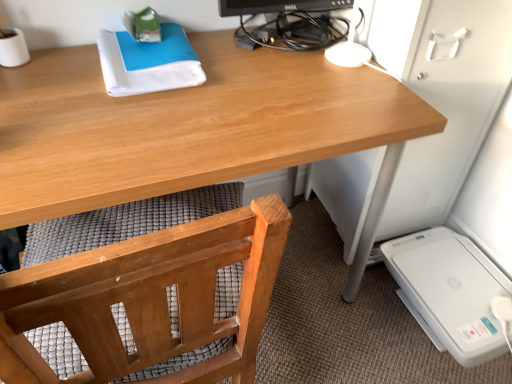
Find the location of a particular element. Image resolution: width=512 pixels, height=384 pixels. blank space situated above wooden desk at center (from a real-world perspective) is located at coordinates (164, 101).